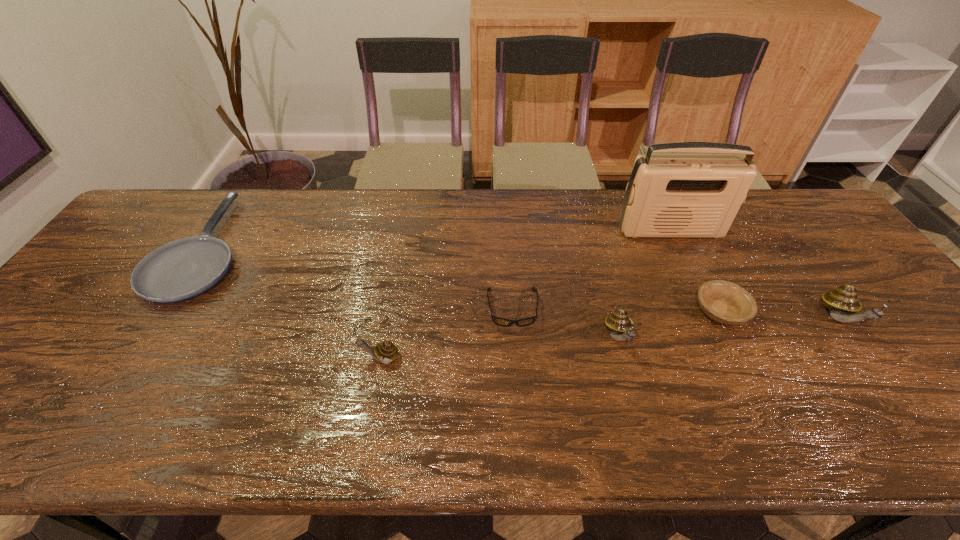
The image size is (960, 540). I want to click on vacant space located 0.340m on the face of the fourth tallest object, so click(214, 358).

You are a GUI agent. You are given a task and a screenshot of the screen. Output one action in this format:
    pyautogui.click(x=<x>, y=<y>)
    Task: Click on the vacant area situated on the face of the fourth tallest object
    Image resolution: width=960 pixels, height=540 pixels.
    Given the screenshot: What is the action you would take?
    pyautogui.click(x=197, y=358)

Locate an element on the screen. vacant area situated 0.240m on the face of the fourth tallest object is located at coordinates (256, 358).

Image resolution: width=960 pixels, height=540 pixels. What are the coordinates of `free spot located on the face of the second tallest snail` in the screenshot? It's located at (631, 382).

The height and width of the screenshot is (540, 960). Find the location of `vacant space located on the face of the second tallest object`. vacant space located on the face of the second tallest object is located at coordinates (871, 362).

Locate an element on the screen. The height and width of the screenshot is (540, 960). blank space located 0.260m on the front-facing side of the radio receiver is located at coordinates (706, 308).

Locate an element on the screen. vacant space located 0.170m on the right of the leftmost object is located at coordinates (304, 248).

Where is `vacant space located on the front-facing side of the spectacles`? vacant space located on the front-facing side of the spectacles is located at coordinates (516, 361).

Locate an element on the screen. vacant space located on the right of the bowl is located at coordinates (806, 312).

The image size is (960, 540). I want to click on radio receiver at the far edge, so click(x=678, y=196).